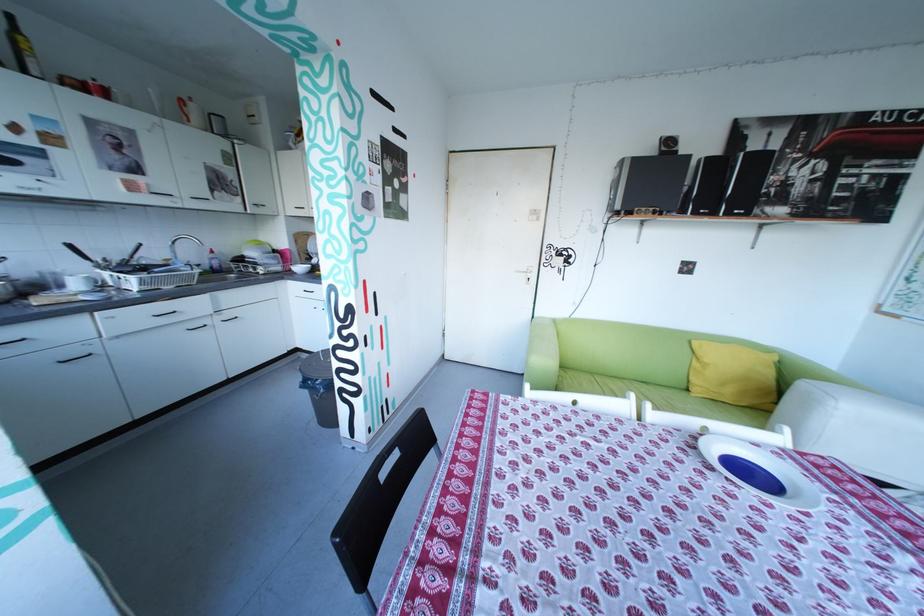
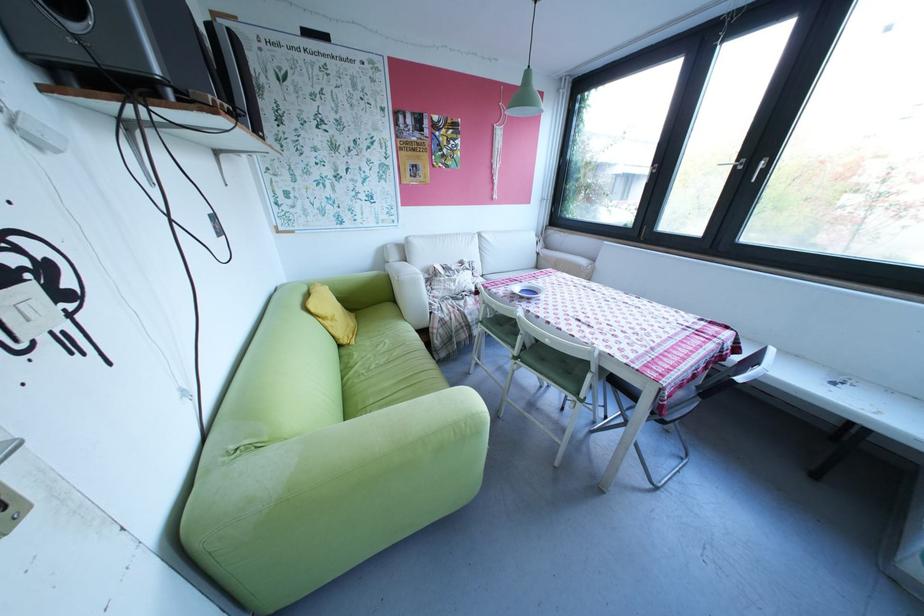
Locate, in the second image, the point that corresponds to pixel 708 363 in the first image.

(339, 323)